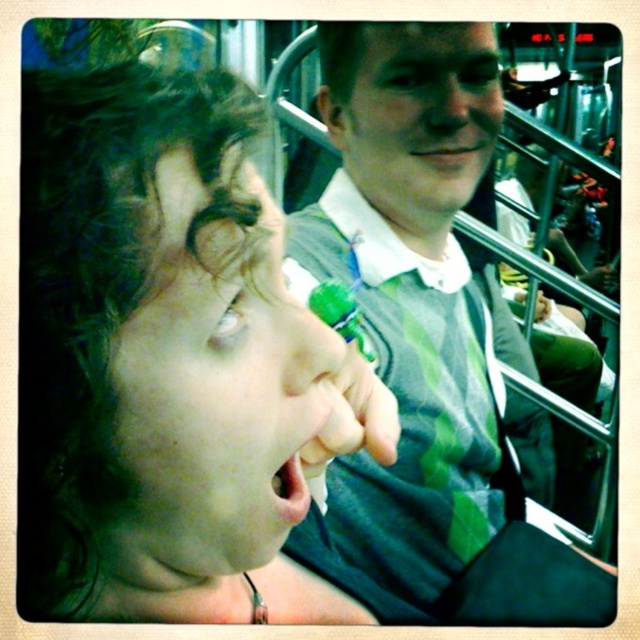
Question: Which point is farther to the camera?

Choices:
 (A) (392, 179)
 (B) (388, 452)

Answer: (A)

Question: From the image, what is the correct spatial relationship of matte green bottle at center in relation to green striped shirt at center?

Choices:
 (A) right
 (B) left

Answer: (B)

Question: Which point is farther from the camera taking this photo?

Choices:
 (A) (481, 26)
 (B) (177, 122)

Answer: (A)

Question: Does matte green bottle at center have a smaller size compared to green striped shirt at center?

Choices:
 (A) no
 (B) yes

Answer: (B)

Question: Can you confirm if matte green bottle at center is positioned to the left of green striped shirt at center?

Choices:
 (A) no
 (B) yes

Answer: (B)